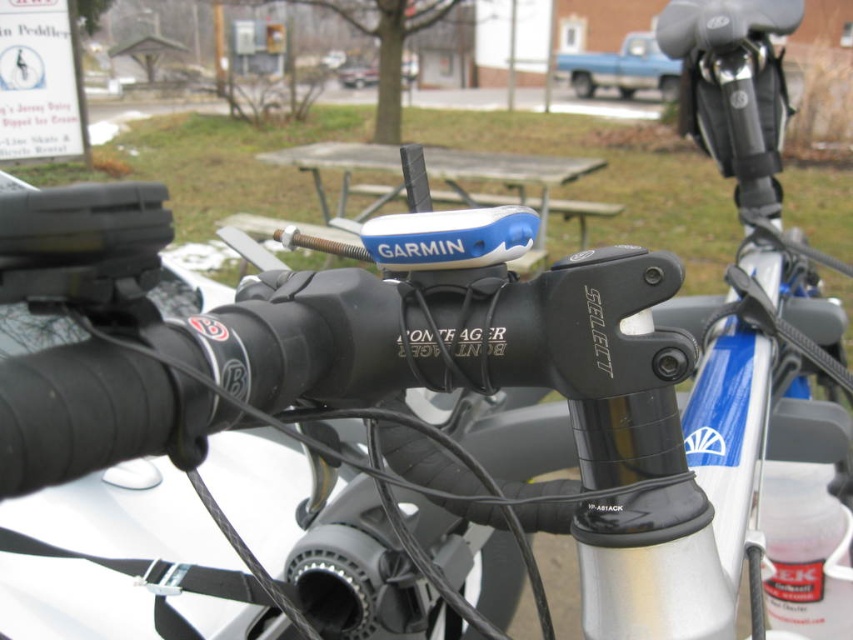
You are a photographer setting up a shot of the bicycle. You need to include both the blue plastic picnic table at center and the blue matte truck at upper center in your frame. Which object should you adjust your camera angle to prioritize if you want to emphasize the larger object?

The blue plastic picnic table at center is larger in size than the blue matte truck at upper center, so you should prioritize framing the blue plastic picnic table at center to emphasize its size.

You are a cyclist who just arrived at a snowy park. You see a blue plastic picnic table at center and a blue matte truck at upper center. Which object is closer to you?

The blue plastic picnic table at center is closer to you because it is in front of the blue matte truck at upper center.

You are a parent trying to decide whether to let your child stand on the blue plastic picnic table at center to reach the blue matte truck at upper center. Based on their heights, is this a safe option?

The blue plastic picnic table at center is taller than the blue matte truck at upper center, so standing on it might not be necessary to reach the truck. However, safety should also consider the stability of the table and the child.